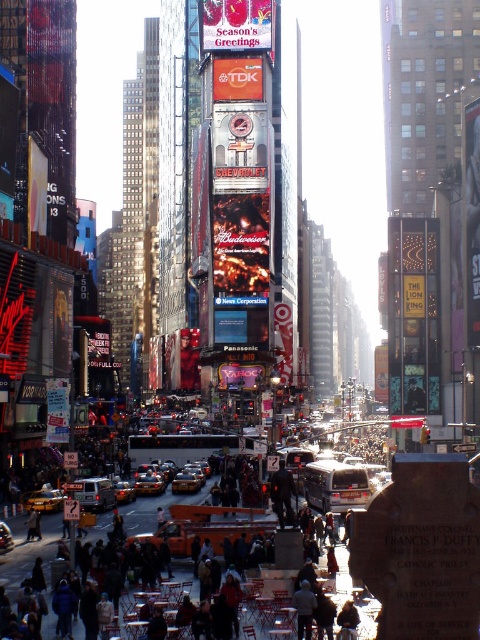
Is point (274, 480) positioned in front of point (175, 477)?

Yes.

Which of these two, dark gray pants at center or yellow metallic taxi at center, stands shorter?

With less height is yellow metallic taxi at center.

Which is behind, point (283, 470) or point (181, 481)?

Point (181, 481)

Where is `dark gray pants at center`? This screenshot has height=640, width=480. dark gray pants at center is located at coordinates (283, 493).

Who is shorter, dark gray concrete crowd at center or dark gray pants at center?

Standing shorter between the two is dark gray concrete crowd at center.

Who is more distant from viewer, (7, 580) or (276, 472)?

The point (276, 472) is behind.

Find the location of a particular element. dark gray concrete crowd at center is located at coordinates (27, 552).

Locate an element on the screen. dark gray concrete crowd at center is located at coordinates (27, 552).

Is point (375, 608) behind point (116, 484)?

No, (375, 608) is closer to viewer.

Image resolution: width=480 pixels, height=640 pixels. What do you see at coordinates (27, 552) in the screenshot? I see `dark gray concrete crowd at center` at bounding box center [27, 552].

Measure the distance between dark gray concrete crowd at center and camera.

A distance of 57.93 meters exists between dark gray concrete crowd at center and camera.

The image size is (480, 640). I want to click on dark gray concrete crowd at center, so click(27, 552).